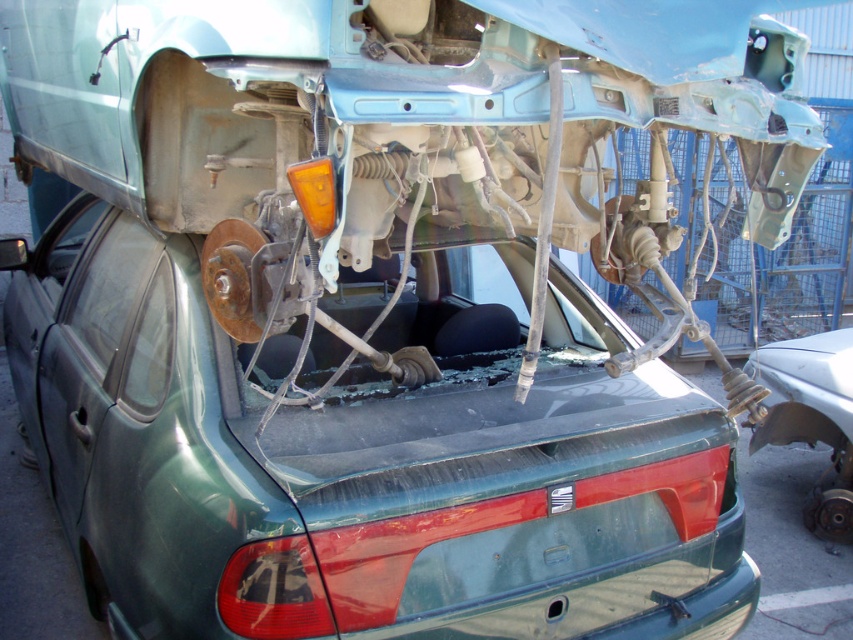
You are a mechanic trying to determine if the rusty metal brake disc at lower right can fit into the green matte car at center. Based on their sizes, can the brake disc be placed inside the car?

The green matte car at center has a larger width than the rusty metal brake disc at lower right. Therefore, the rusty metal brake disc at lower right can fit inside the green matte car at center.

You are a mechanic inspecting the damaged car. You notice the transparent glass windshield at center and the rusty metal brake disc at lower right. Which object is shorter in height?

The transparent glass windshield at center has a lesser height compared to the rusty metal brake disc at lower right, so the transparent glass windshield at center is shorter in height.

You are a mechanic inspecting a damaged car. You see the green matte car at center and the rusty metal brake disc at lower right. Which object is larger in size?

The green matte car at center is bigger than the rusty metal brake disc at lower right.